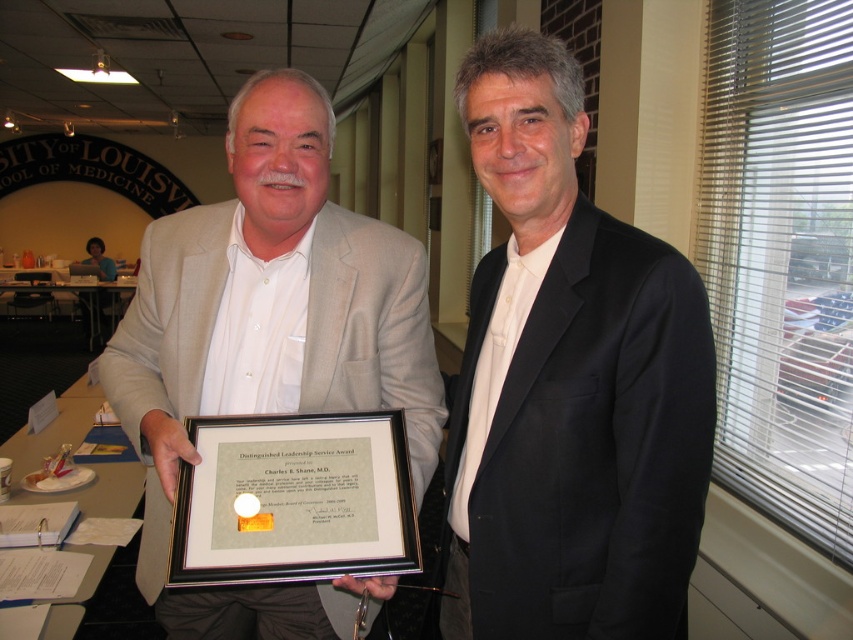
You are an event organizer arranging a photo shoot in the University of Louisville School of Medicine office. You need to place a black satin suit at center in the scene. Where should you position it relative to the two men and the framed certificate?

The black satin suit at center should be positioned at coordinates point (569, 385) as specified in the description.

You are a tailor who needs to determine which suit requires a longer sleeve adjustment. Based on the image, which suit is shorter in height between the black satin suit at center and the matte beige suit at center?

The black satin suit at center is not as tall as the matte beige suit at center, so the black satin suit at center requires a longer sleeve adjustment to match the height of the matte beige suit at center.